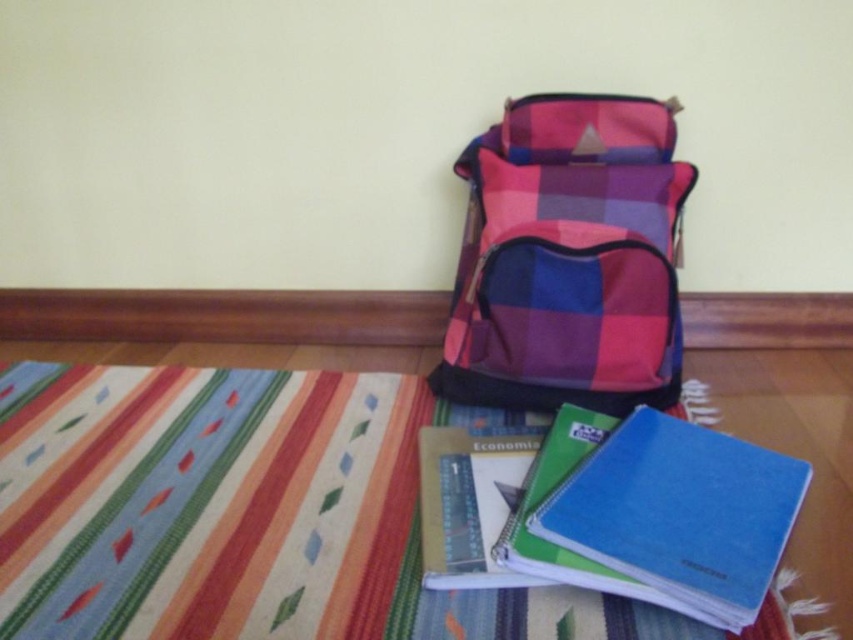
You are standing at the point marked by the coordinates point (204, 500) in the image. What object are you currently standing on?

You are standing on the striped fabric mat at lower center, which is marked by the coordinates point (204, 500).

You are organizing items on a desk and need to place the plaid fabric backpack at center and the blue matte notebook at lower right. If the desk has limited space, which item should you move first to free up more space?

The plaid fabric backpack at center should be moved first because its width is larger than the blue matte notebook at lower right, freeing up more space.

You are a delivery robot with a package that needs to be placed between the plaid fabric backpack at center and the blue matte notebook at lower right. The package is 25 centimeters long. Can you fit the package between them without moving either item?

The distance between the plaid fabric backpack at center and the blue matte notebook at lower right is 26.92 centimeters. Since the package is 25 centimeters long, it can fit between them as the space is slightly larger than the package.